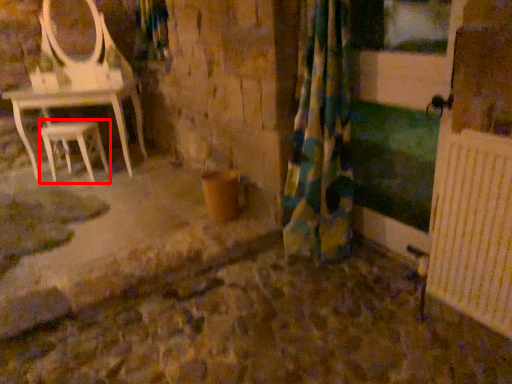
Question: In this image, where is stool (annotated by the red box) located relative to curtain?

Choices:
 (A) right
 (B) left

Answer: (B)